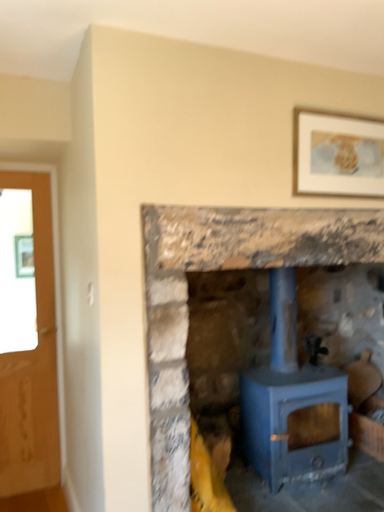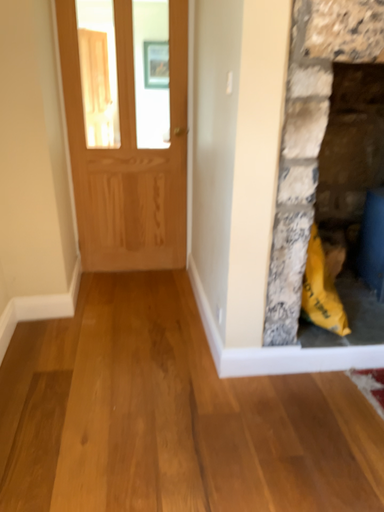
Question: Which way did the camera rotate in the video?

Choices:
 (A) rotated left
 (B) rotated right

Answer: (A)